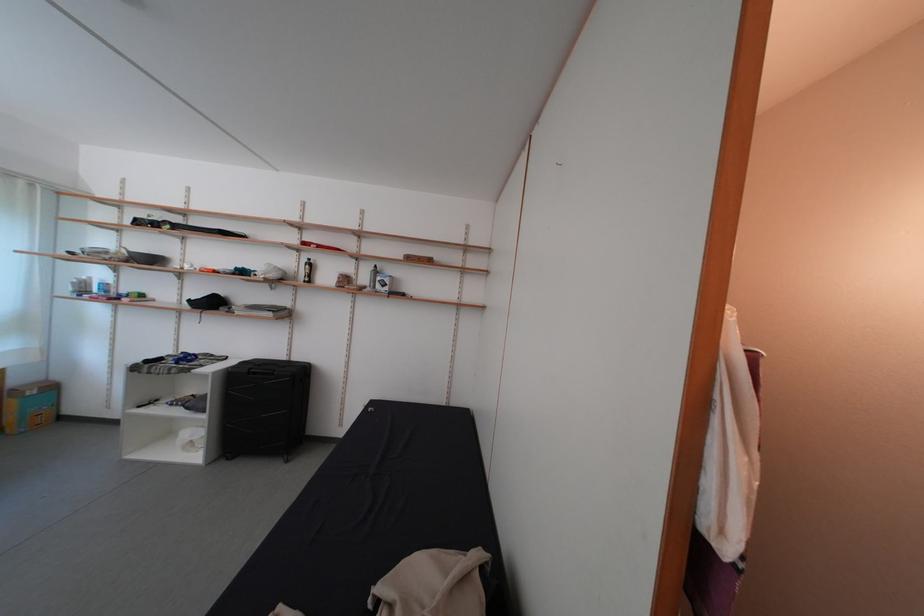
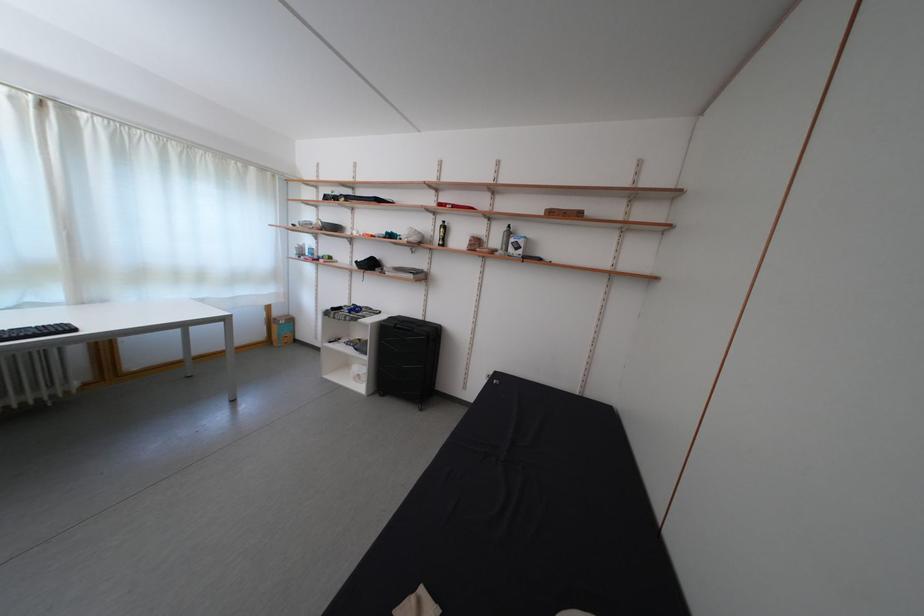
The point at (x=112, y=246) is marked in the first image. Where is the corresponding point in the second image?

(319, 221)